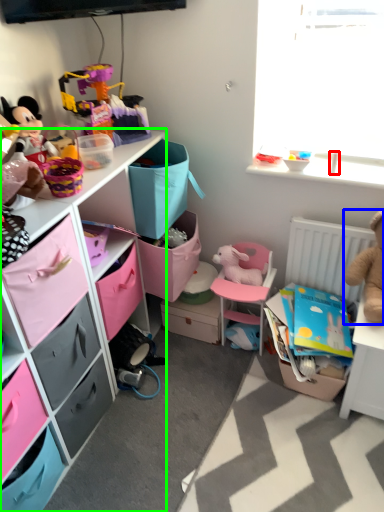
Question: Estimate the real-world distances between objects in this image. Which object is farther from toy (highlighted by a red box), toy (highlighted by a blue box) or cabinetry (highlighted by a green box)?

Choices:
 (A) toy
 (B) cabinetry

Answer: (B)